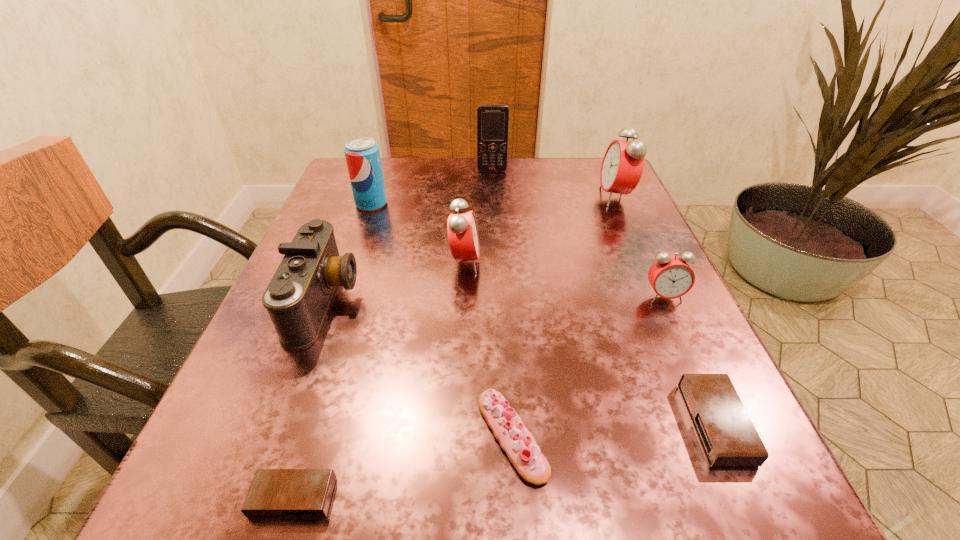
This screenshot has height=540, width=960. Find the location of `vacant space that satisfies the following two spatial constraints: 1. on the screen of the orange cellular telephone; 2. on the lens of the camera`. vacant space that satisfies the following two spatial constraints: 1. on the screen of the orange cellular telephone; 2. on the lens of the camera is located at coordinates (497, 301).

Locate an element on the screen. The width and height of the screenshot is (960, 540). free location that satisfies the following two spatial constraints: 1. on the front face of the second shortest alarm clock; 2. on the front face of the left black alarm clock is located at coordinates (748, 497).

Identify the location of free spot that satisfies the following two spatial constraints: 1. on the lens of the third shortest object; 2. on the left side of the camera. (x=273, y=437).

At what (x,y) coordinates should I click in order to perform the action: click on vacant area in the image that satisfies the following two spatial constraints: 1. on the front-facing side of the tallest alarm clock; 2. on the front side of the seventh tallest object. Please return your answer as a coordinate pair (x, y). Image resolution: width=960 pixels, height=540 pixels. Looking at the image, I should click on (722, 437).

The image size is (960, 540). Find the location of `free space that satisfies the following two spatial constraints: 1. on the front side of the soda can; 2. on the lens of the camera`. free space that satisfies the following two spatial constraints: 1. on the front side of the soda can; 2. on the lens of the camera is located at coordinates pyautogui.click(x=338, y=301).